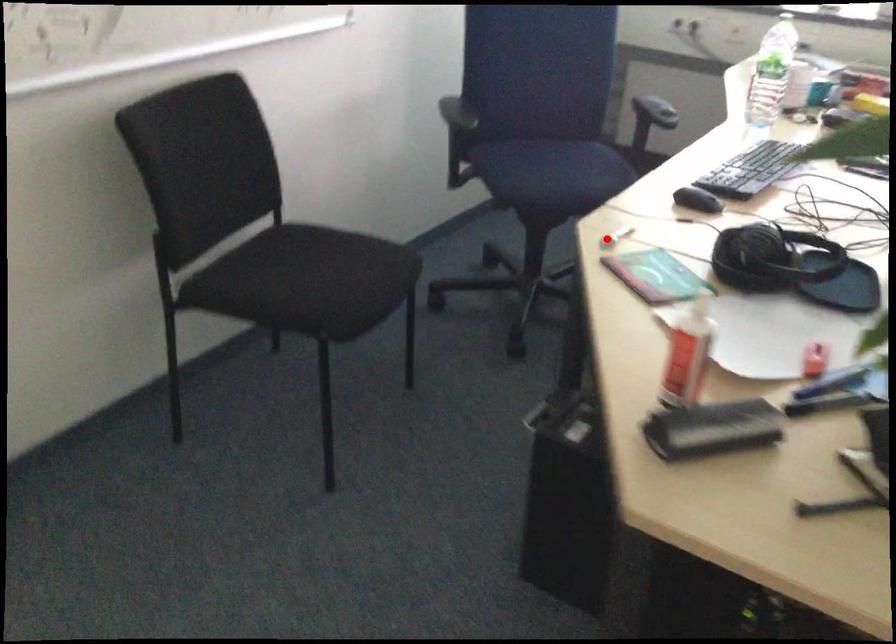
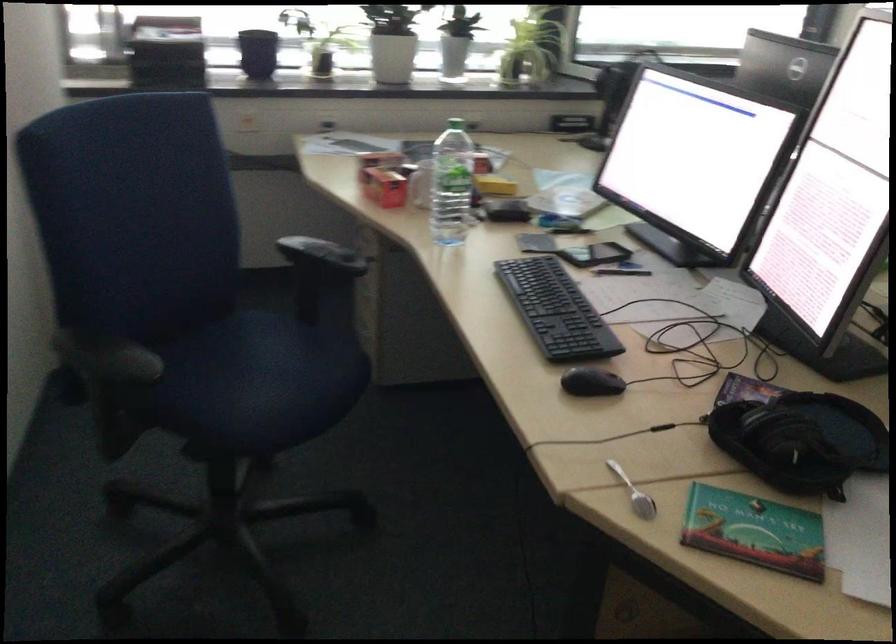
Question: I am providing you with two images of the same scene from different viewpoints. Image1 has a red point marked. In image2, the corresponding 3D location appears at what relative position? Reply with the corresponding letter.

Choices:
 (A) Closer
 (B) Farther

Answer: (A)